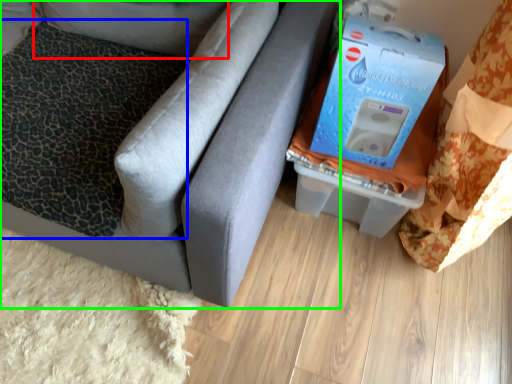
Question: Estimate the real-world distances between objects in this image. Which object is closer to pillow (highlighted by a red box), pillow (highlighted by a blue box) or furniture (highlighted by a green box)?

Choices:
 (A) pillow
 (B) furniture

Answer: (A)